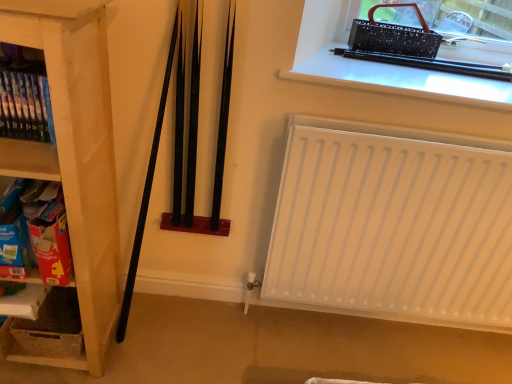
Question: Is black plastic pen at upper right to the left of white matte radiator at lower right from the viewer's perspective?

Choices:
 (A) no
 (B) yes

Answer: (B)

Question: Is black plastic pen at upper right at the right side of white matte radiator at lower right?

Choices:
 (A) yes
 (B) no

Answer: (B)

Question: Is black plastic pen at upper right bigger than white matte radiator at lower right?

Choices:
 (A) yes
 (B) no

Answer: (B)

Question: From the image's perspective, does black plastic pen at upper right appear lower than white matte radiator at lower right?

Choices:
 (A) no
 (B) yes

Answer: (A)

Question: Does black plastic pen at upper right have a smaller size compared to white matte radiator at lower right?

Choices:
 (A) yes
 (B) no

Answer: (A)

Question: Considering the relative sizes of black plastic pen at upper right and white matte radiator at lower right in the image provided, is black plastic pen at upper right shorter than white matte radiator at lower right?

Choices:
 (A) yes
 (B) no

Answer: (A)

Question: Is cardboard box at left, the first shelf from the bottom, further to camera compared to white cardboard box at lower left?

Choices:
 (A) yes
 (B) no

Answer: (B)

Question: From the image's perspective, is cardboard box at left, the first shelf from the bottom, under white cardboard box at lower left?

Choices:
 (A) no
 (B) yes

Answer: (A)

Question: From the image's perspective, is cardboard box at left, the third shelf when ordered from top to bottom, over white cardboard box at lower left?

Choices:
 (A) no
 (B) yes

Answer: (B)

Question: Considering the relative positions of cardboard box at left, the third shelf when ordered from top to bottom, and white cardboard box at lower left in the image provided, is cardboard box at left, the third shelf when ordered from top to bottom, in front of white cardboard box at lower left?

Choices:
 (A) no
 (B) yes

Answer: (B)

Question: From a real-world perspective, is cardboard box at left, the first shelf from the bottom, below white cardboard box at lower left?

Choices:
 (A) no
 (B) yes

Answer: (A)

Question: Can you confirm if cardboard box at left, the first shelf from the bottom, is taller than white cardboard box at lower left?

Choices:
 (A) no
 (B) yes

Answer: (B)

Question: From the image's perspective, is black plastic pen at upper right above white cardboard box at lower left?

Choices:
 (A) yes
 (B) no

Answer: (A)